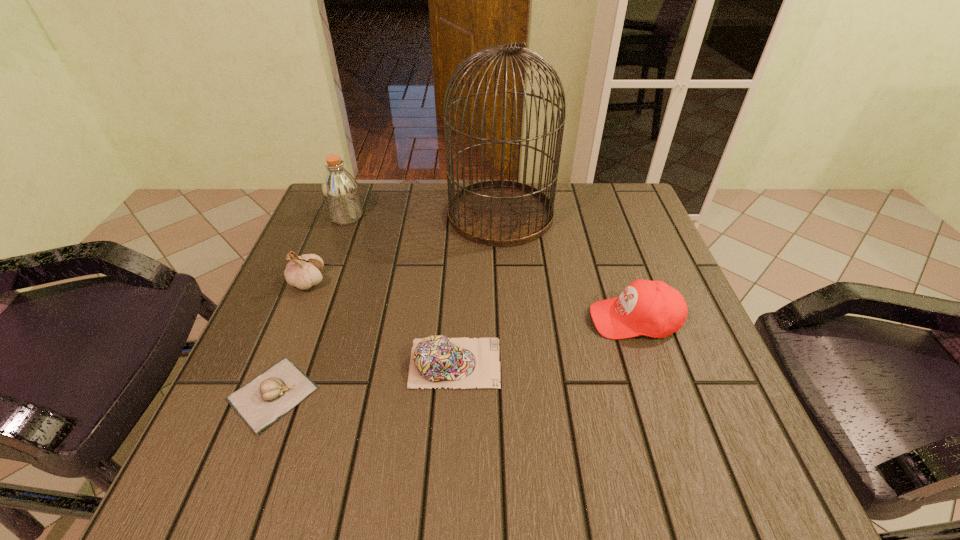
The height and width of the screenshot is (540, 960). I want to click on the tallest object, so click(x=501, y=213).

What are the coordinates of `bottle` in the screenshot? It's located at (340, 190).

Find the location of a particular element. This screenshot has height=540, width=960. the third farthest object is located at coordinates (303, 272).

Find the location of `the farther garlic`. the farther garlic is located at coordinates (303, 272).

Locate an element on the screen. the third shortest object is located at coordinates (652, 308).

You are a GUI agent. You are given a task and a screenshot of the screen. Output one action in this format:
    pyautogui.click(x=<x>, y=<y>)
    Task: Click on the baseball cap
    The height and width of the screenshot is (540, 960).
    Given the screenshot: What is the action you would take?
    pyautogui.click(x=652, y=308)

Locate an element on the screen. The image size is (960, 540). cap is located at coordinates (436, 361).

In order to click on the shortest object in this screenshot , I will do `click(261, 402)`.

You are a GUI agent. You are given a task and a screenshot of the screen. Output one action in this format:
    pyautogui.click(x=<x>, y=<y>)
    Task: Click on the nearer garlic
    Image resolution: width=960 pixels, height=540 pixels.
    Given the screenshot: What is the action you would take?
    pyautogui.click(x=261, y=402)

Where is `free space located on the left of the birdcage`? This screenshot has height=540, width=960. free space located on the left of the birdcage is located at coordinates (425, 214).